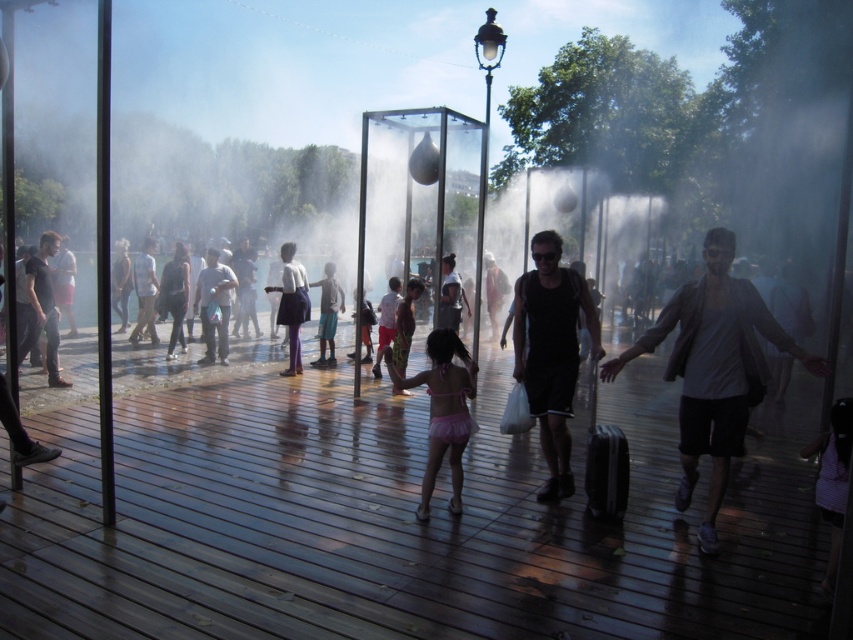
Which is below, gray cotton shirt at center or light blue fabric pants at center?

gray cotton shirt at center is lower down.

What do you see at coordinates (714, 369) in the screenshot? The width and height of the screenshot is (853, 640). I see `gray cotton shirt at center` at bounding box center [714, 369].

Is point (608, 380) behind point (331, 278)?

No, it is not.

Where is `gray cotton shirt at center`? The height and width of the screenshot is (640, 853). gray cotton shirt at center is located at coordinates (714, 369).

From the picture: Who is positioned more to the right, gray cotton shirt at center or black matte tank top at center?

gray cotton shirt at center

Who is more forward, (x=776, y=323) or (x=553, y=237)?

Point (x=776, y=323)

Identify the location of gray cotton shirt at center. (714, 369).

Can you confirm if pink fabric bikini at center is positioned to the right of light blue fabric pants at center?

Correct, you'll find pink fabric bikini at center to the right of light blue fabric pants at center.

Who is taller, pink fabric bikini at center or light blue fabric pants at center?

With more height is light blue fabric pants at center.

What are the coordinates of `pink fabric bikini at center` in the screenshot? It's located at (442, 410).